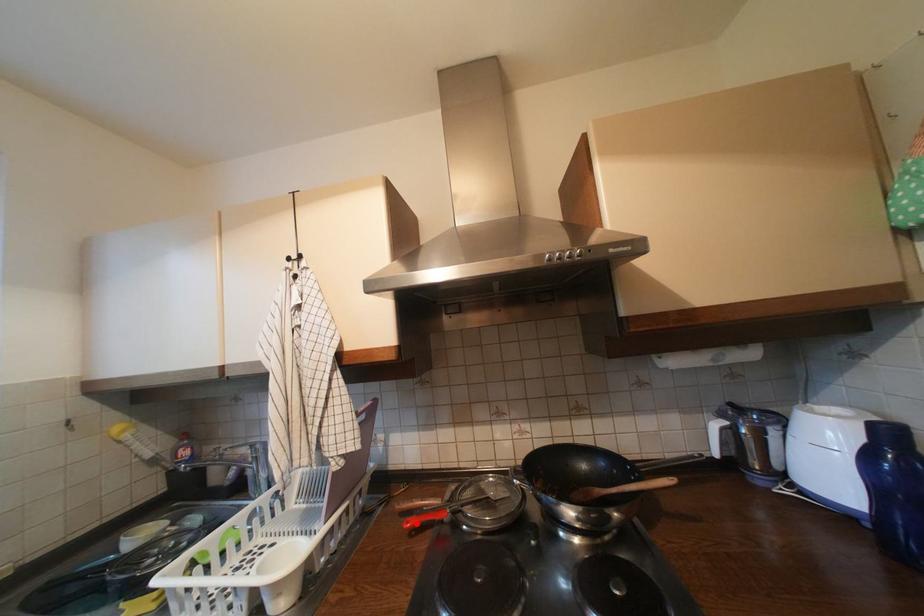
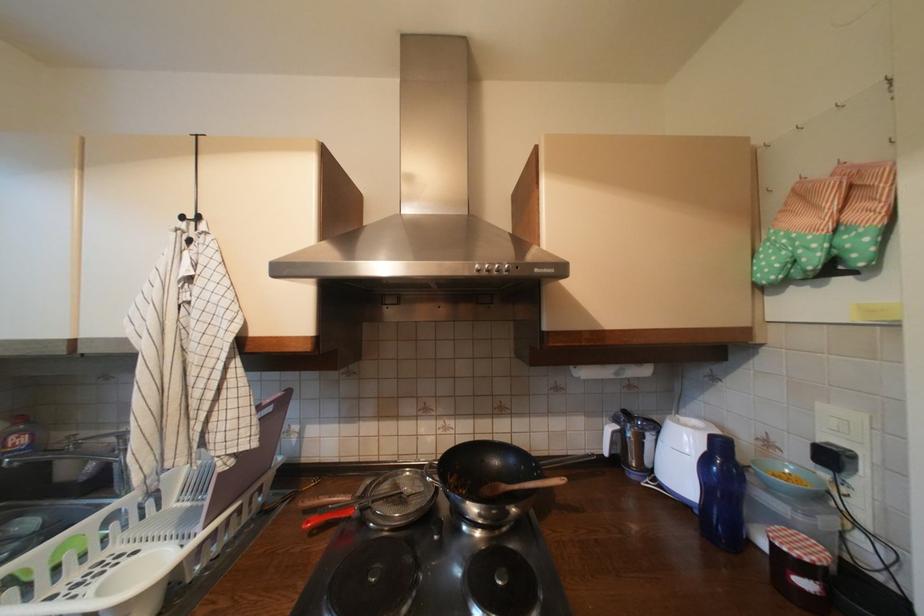
The point at the highlighted location is marked in the first image. Where is the corresponding point in the second image?

(317, 524)